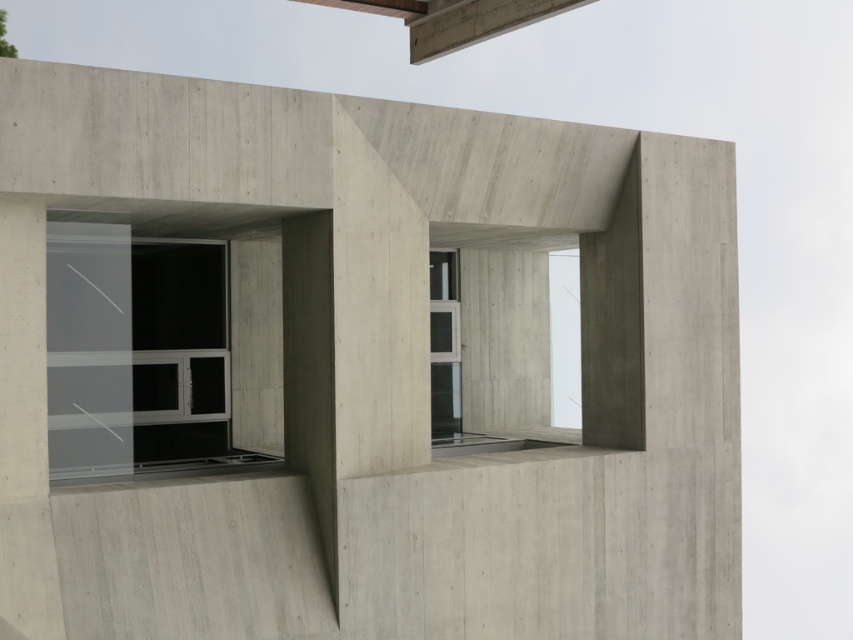
You are standing in front of the modern architectural structure. You want to find the transparent glass window at center. Where should you look in terms of horizontal and vertical position relative to the structure?

The transparent glass window at center is located at the 2D coordinates of point 0.553 on the horizontal axis and 0.162 on the vertical axis relative to the structure.

You are standing in front of the modern architectural structure and want to determine the relative positions of two points marked on the building. The points are labeled as point (90, 371) and point (444, 348). Which point is closer to your viewpoint?

Point (90, 371) is closer to the camera than point (444, 348).

You are an architect designing a new building and want to ensure proper lighting. You have two windows to choose from in the center of the building design. Which window, the transparent glass window at center or the clear glass window at center, allows more light to pass through based on their widths?

The clear glass window at center is wider than the transparent glass window at center, so it allows more light to pass through.